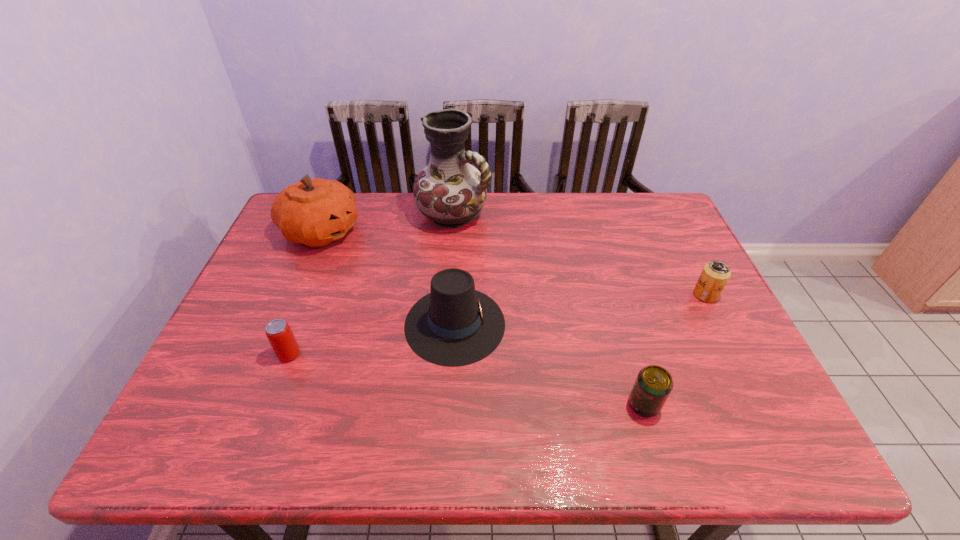
Find the location of `free spot located on the front-facing side of the third tallest object`. free spot located on the front-facing side of the third tallest object is located at coordinates (656, 323).

At what (x,y) coordinates should I click in order to perform the action: click on free space located on the back of the rightmost beer can. Please return your answer as a coordinate pair (x, y). The height and width of the screenshot is (540, 960). Looking at the image, I should click on (660, 205).

Find the location of a particular element. vacant space located on the left of the second beer can from right to left is located at coordinates (503, 404).

Locate an element on the screen. Image resolution: width=960 pixels, height=540 pixels. vacant point located 0.070m on the right of the second farthest beer can is located at coordinates (330, 354).

Locate an element on the screen. This screenshot has height=540, width=960. vase located in the far edge section of the desktop is located at coordinates (451, 192).

You are a GUI agent. You are given a task and a screenshot of the screen. Output one action in this format:
    pyautogui.click(x=<x>, y=<y>)
    Task: Click on the pumpkin that is at the far edge
    The height and width of the screenshot is (540, 960).
    Given the screenshot: What is the action you would take?
    pyautogui.click(x=315, y=212)

Locate an element on the screen. The image size is (960, 540). object that is at the near edge is located at coordinates [653, 385].

The width and height of the screenshot is (960, 540). Identify the location of pumpkin present at the left edge. (315, 212).

The image size is (960, 540). What are the coordinates of `beer can at the left edge` in the screenshot? It's located at (282, 340).

Locate an element on the screen. The width and height of the screenshot is (960, 540). object that is positioned at the right edge is located at coordinates (715, 274).